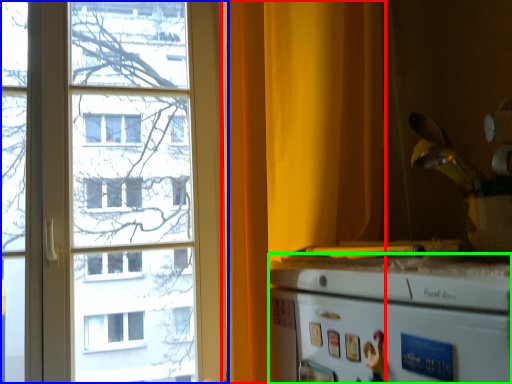
Question: Which object is positioned farthest from curtain (highlighted by a red box)? Select from window (highlighted by a blue box) and appliance (highlighted by a green box).

Choices:
 (A) window
 (B) appliance

Answer: (A)